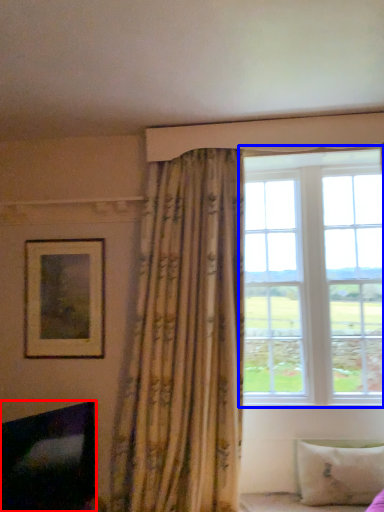
Question: Which of the following is the farthest to the observer, fireplace (highlighted by a red box) or window (highlighted by a blue box)?

Choices:
 (A) fireplace
 (B) window

Answer: (B)